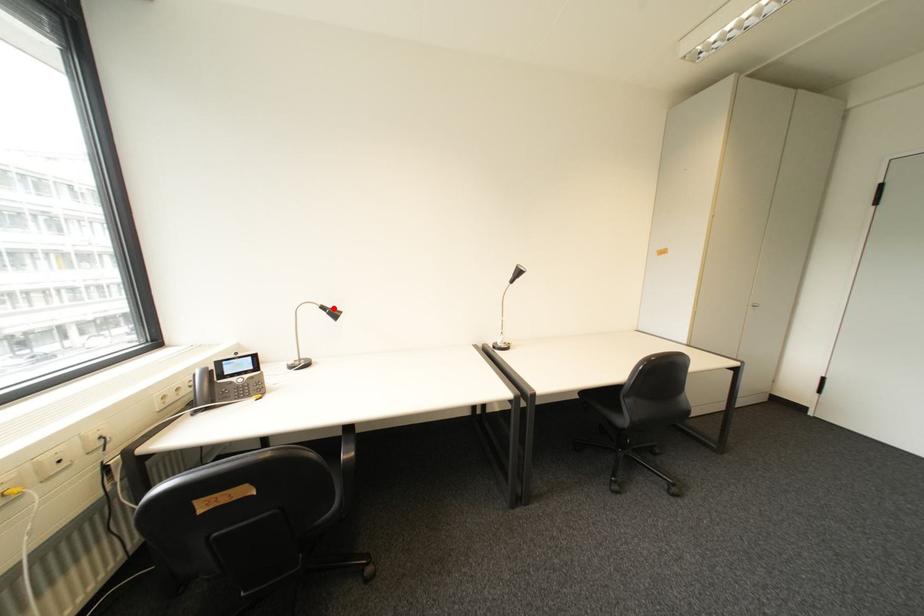
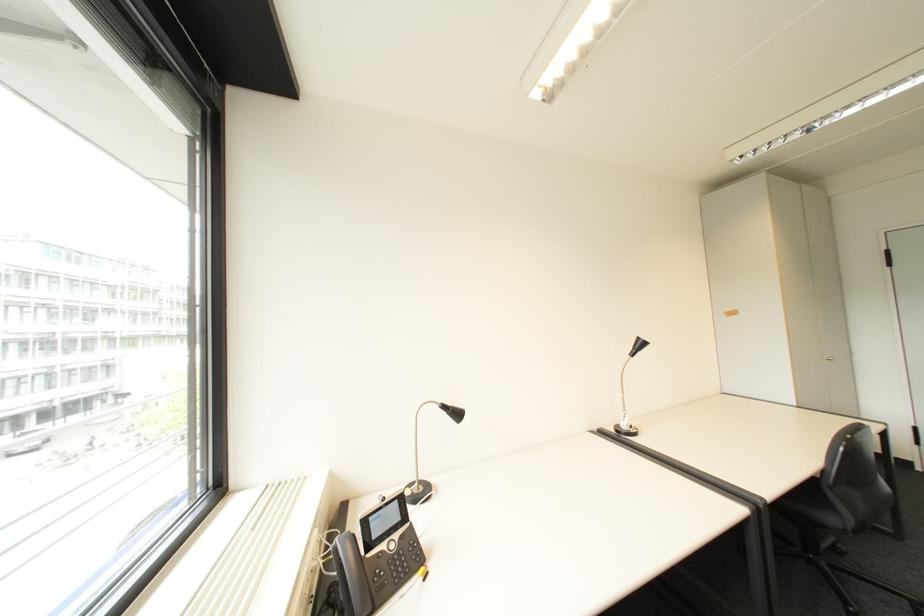
Question: I am providing you with two images of the same scene from different viewpoints. A red point is marked on the first image. Can you still see the location of the red point in image 2?

Choices:
 (A) Yes
 (B) No

Answer: (A)